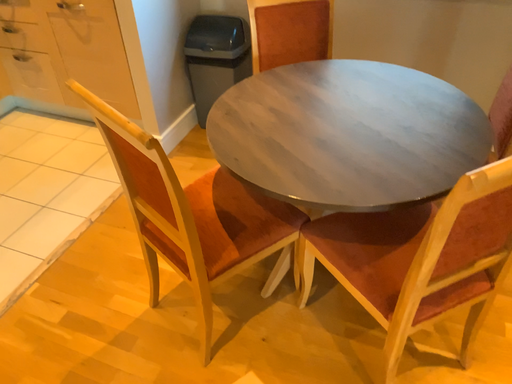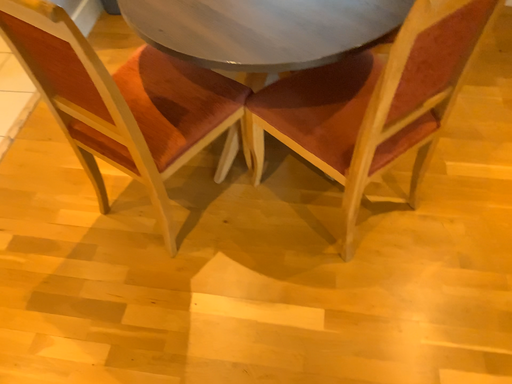
Question: How did the camera likely rotate when shooting the video?

Choices:
 (A) rotated downward
 (B) rotated upward

Answer: (A)